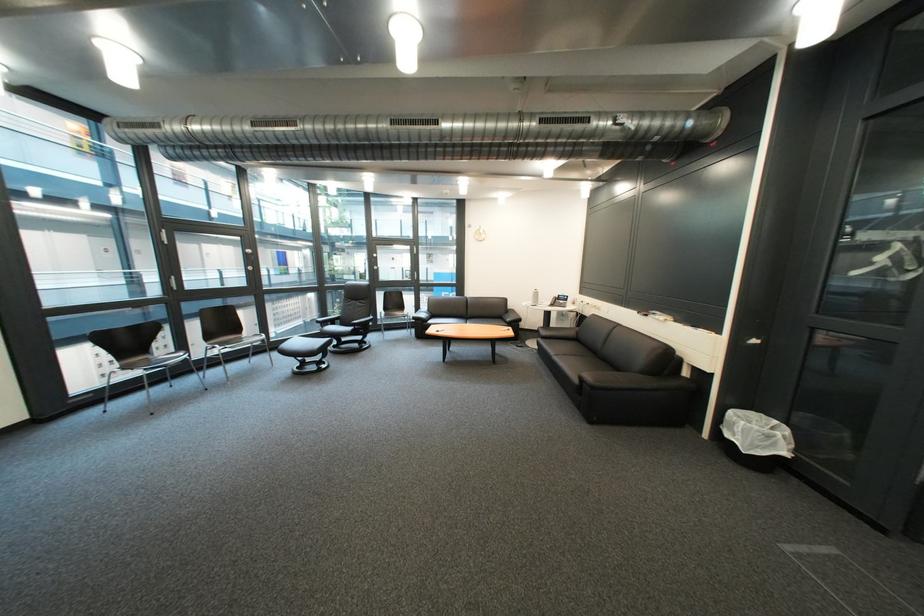
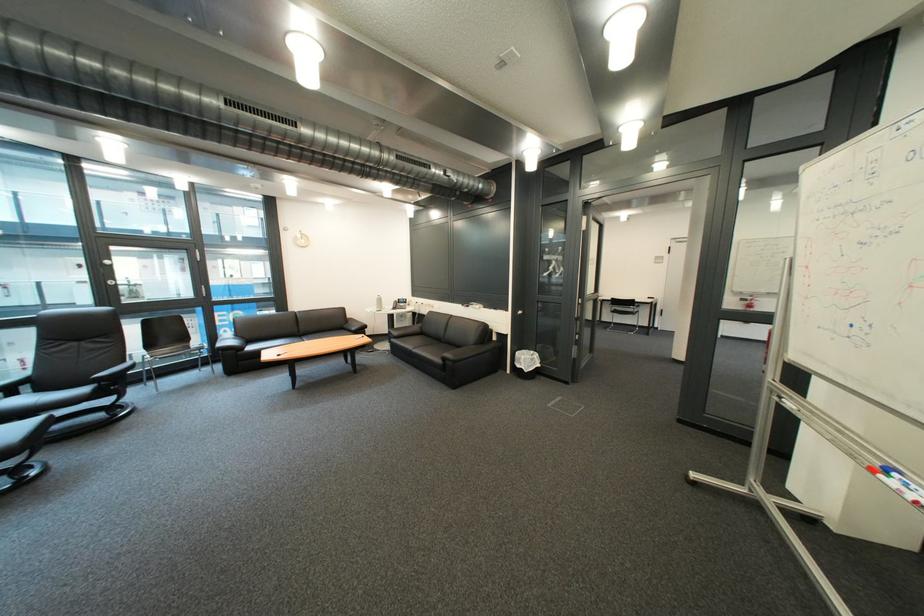
In the second image, find the point that corresponds to (x=569, y=360) in the first image.

(429, 353)